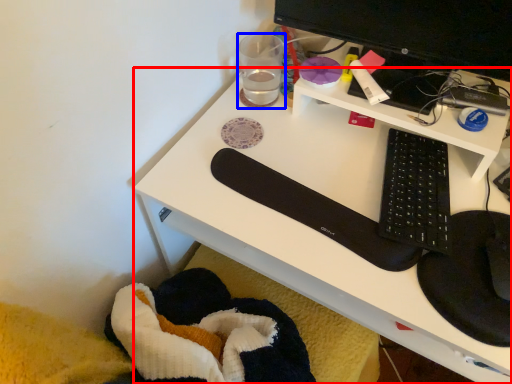
Question: Which object is closer to the camera taking this photo, desk (highlighted by a red box) or stationery (highlighted by a blue box)?

Choices:
 (A) desk
 (B) stationery

Answer: (A)